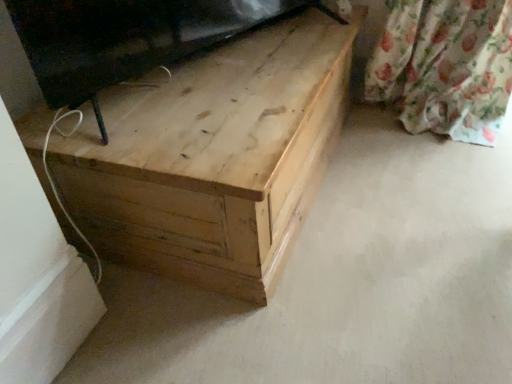
Find the location of a particular element. Image resolution: width=512 pixels, height=384 pixels. natural wood chest at center is located at coordinates (213, 157).

What is the approximate width of natural wood chest at center?

It is 28.23 inches.

What do you see at coordinates (213, 157) in the screenshot? Image resolution: width=512 pixels, height=384 pixels. I see `natural wood chest at center` at bounding box center [213, 157].

Locate an element on the screen. natural wood chest at center is located at coordinates (213, 157).